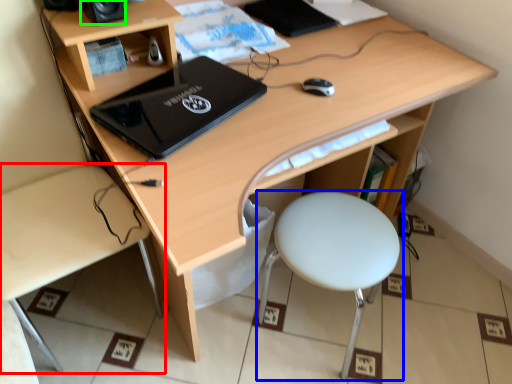
Question: Which object is the farthest from desk (highlighted by a red box)? Choose among these: stool (highlighted by a blue box) or speaker (highlighted by a green box).

Choices:
 (A) stool
 (B) speaker

Answer: (A)